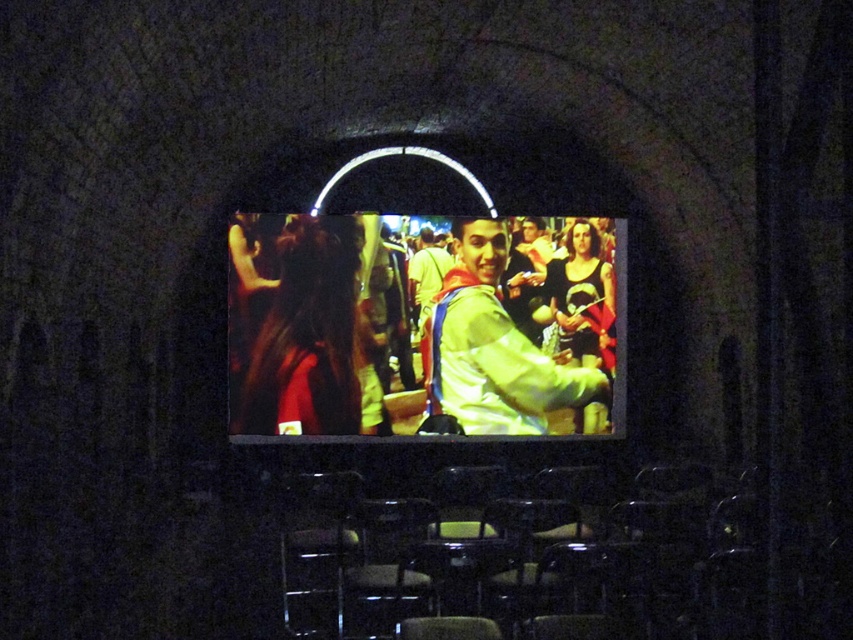
Question: Which of the following is the farthest from the observer?

Choices:
 (A) light green fabric jacket at center
 (B) shiny silver jacket at center

Answer: (A)

Question: Which point is closer to the camera taking this photo?

Choices:
 (A) (305, 406)
 (B) (438, 374)

Answer: (A)

Question: Considering the relative positions of shiny silver jacket at center and light green fabric jacket at center in the image provided, where is shiny silver jacket at center located with respect to light green fabric jacket at center?

Choices:
 (A) above
 (B) below

Answer: (A)

Question: Observing the image, what is the correct spatial positioning of shiny silver jacket at center in reference to light green fabric jacket at center?

Choices:
 (A) left
 (B) right

Answer: (A)

Question: Can you confirm if shiny silver jacket at center is bigger than light green fabric jacket at center?

Choices:
 (A) yes
 (B) no

Answer: (A)